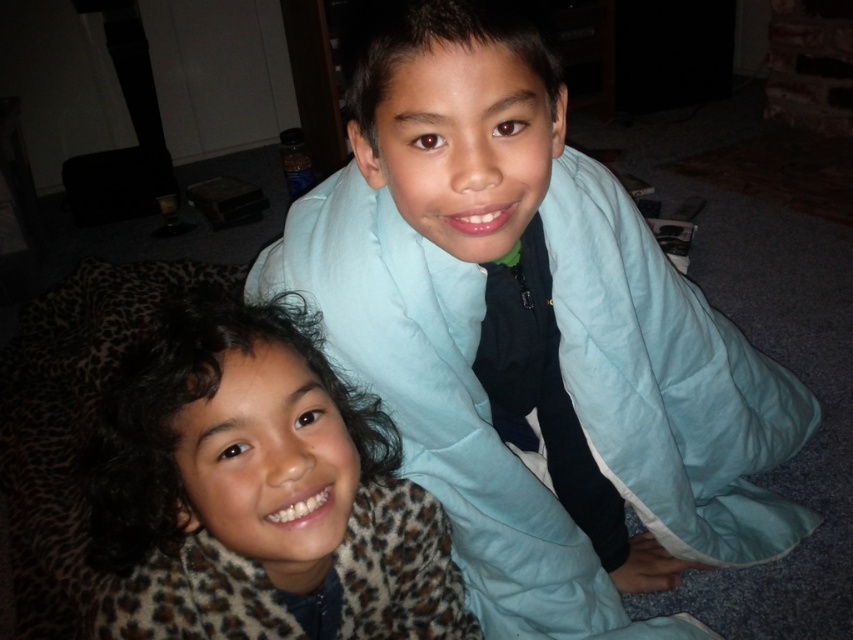
Question: Can you confirm if light blue quilted blanket at upper center is positioned to the right of leopard print sweater at lower left?

Choices:
 (A) no
 (B) yes

Answer: (B)

Question: Is light blue quilted blanket at upper center smaller than leopard print sweater at lower left?

Choices:
 (A) no
 (B) yes

Answer: (A)

Question: Does light blue quilted blanket at upper center appear under leopard print sweater at lower left?

Choices:
 (A) yes
 (B) no

Answer: (B)